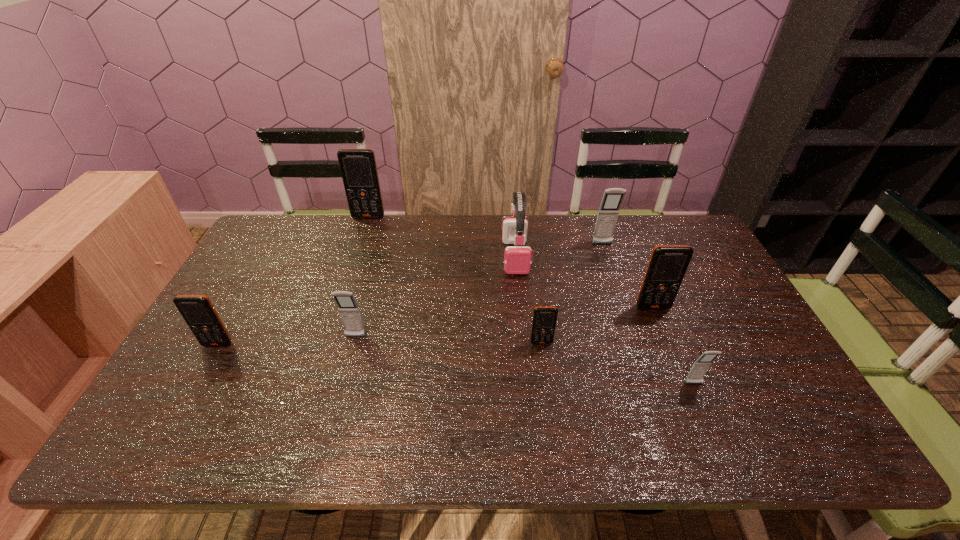
Identify the location of free space that is in between the third orange cellular telephone from left to right and the biggest orange cellular telephone. The height and width of the screenshot is (540, 960). (455, 280).

Where is `blank region between the pink earphone and the fourth nearest cellular telephone`? blank region between the pink earphone and the fourth nearest cellular telephone is located at coordinates (436, 297).

This screenshot has width=960, height=540. I want to click on object that can be found as the third closest to the farthest orange cellular telephone, so click(x=197, y=310).

Select which object appears as the sixth closest to the earphone. Please provide its 2D coordinates. Your answer should be formatted as a tuple, i.e. [(x, y)], where the tuple contains the x and y coordinates of a point satisfying the conditions above.

[(700, 367)]

Identify which cellular telephone is located as the second nearest to the leftmost cellular telephone. Please provide its 2D coordinates. Your answer should be formatted as a tuple, i.e. [(x, y)], where the tuple contains the x and y coordinates of a point satisfying the conditions above.

[(358, 167)]

Image resolution: width=960 pixels, height=540 pixels. I want to click on cellular telephone that is the third nearest to the third biggest orange cellular telephone, so click(544, 320).

Select which orange cellular telephone is the third closest to the third cellular telephone from right to left. Please provide its 2D coordinates. Your answer should be formatted as a tuple, i.e. [(x, y)], where the tuple contains the x and y coordinates of a point satisfying the conditions above.

[(358, 167)]

You are a GUI agent. You are given a task and a screenshot of the screen. Output one action in this format:
    pyautogui.click(x=<x>, y=<y>)
    Task: Click on the orange cellular telephone that is the second closest to the farthest cellular telephone
    The image size is (960, 540).
    Given the screenshot: What is the action you would take?
    click(x=544, y=320)

This screenshot has width=960, height=540. What are the coordinates of `gray cellular telephone that can be found as the second closest to the rightmost gray cellular telephone` in the screenshot? It's located at (350, 314).

Locate which gray cellular telephone is the closest to the smallest gray cellular telephone. Please provide its 2D coordinates. Your answer should be formatted as a tuple, i.e. [(x, y)], where the tuple contains the x and y coordinates of a point satisfying the conditions above.

[(608, 212)]